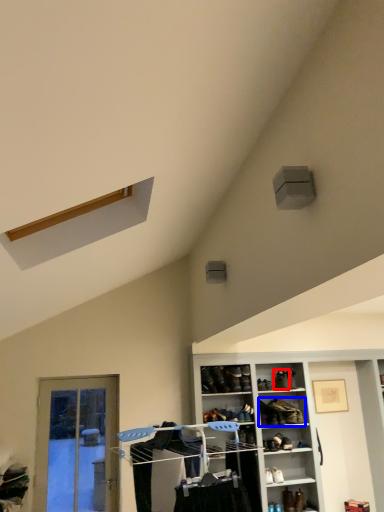
Question: Which point is further to the camera, shoe (highlighted by a red box) or footwear (highlighted by a blue box)?

Choices:
 (A) shoe
 (B) footwear

Answer: (A)